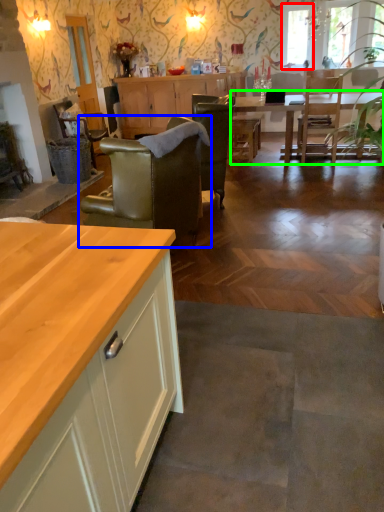
Question: Which object is the farthest from window screen (highlighted by a red box)? Choose among these: chair (highlighted by a blue box) or kitchen & dining room table (highlighted by a green box).

Choices:
 (A) chair
 (B) kitchen & dining room table

Answer: (A)